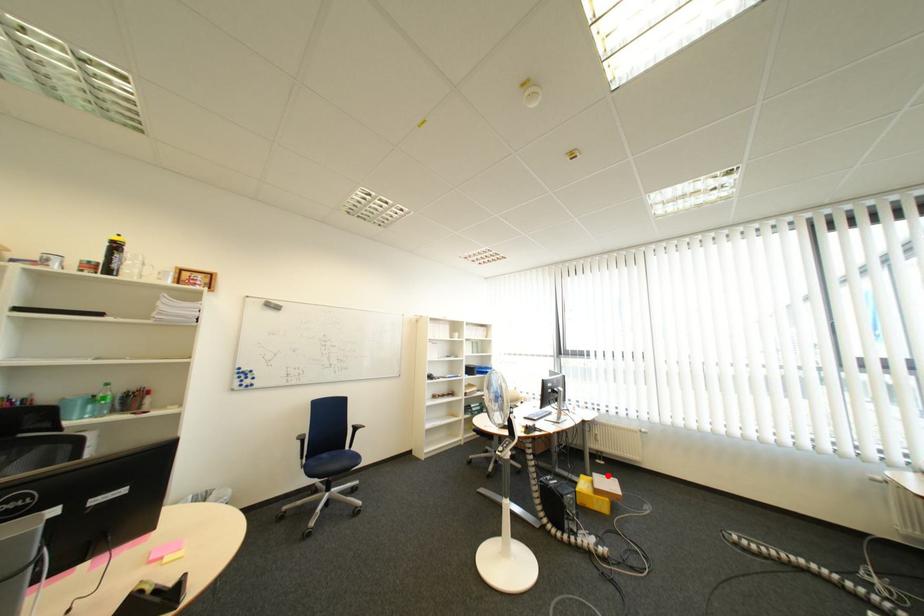
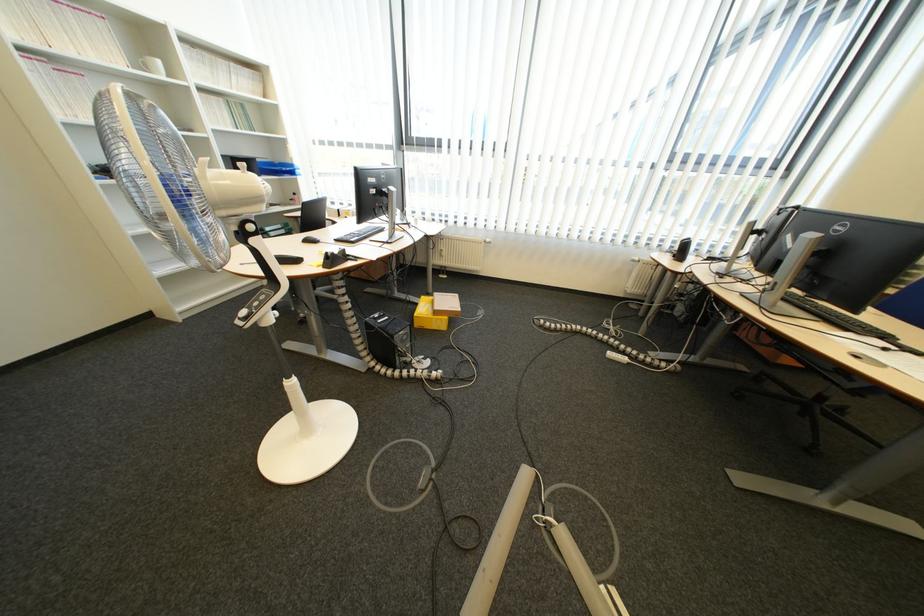
Question: I am providing you with two images of the same scene from different viewpoints. Given a red point in image1, look at the same physical point in image2. Is it:

Choices:
 (A) Closer to the viewpoint
 (B) Farther from the viewpoint

Answer: (B)